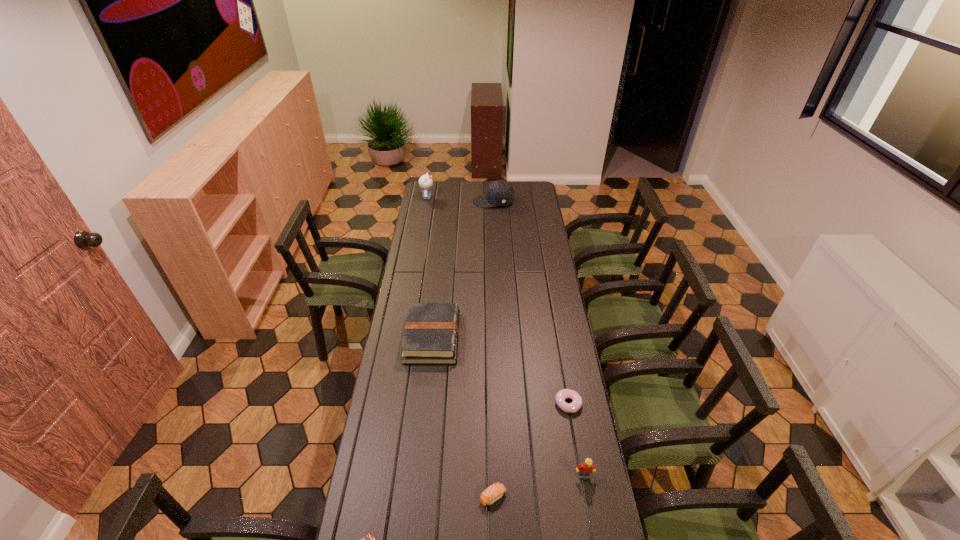
The image size is (960, 540). What are the coordinates of `kitten` in the screenshot? It's located at (425, 182).

Where is `baseball cap`? baseball cap is located at coordinates (500, 193).

Find the location of `the fifth shortest object`. the fifth shortest object is located at coordinates click(x=585, y=469).

Locate an element on the screen. The image size is (960, 540). the fifth farthest object is located at coordinates click(x=585, y=469).

Locate an element on the screen. The width and height of the screenshot is (960, 540). the fourth tallest object is located at coordinates (431, 334).

You are a GUI agent. You are given a task and a screenshot of the screen. Output one action in this format:
    pyautogui.click(x=<x>, y=<y>)
    Task: Click on the third farthest object
    
    Given the screenshot: What is the action you would take?
    pyautogui.click(x=431, y=334)

Find the location of a particular element. doughnut is located at coordinates 575,405.

Find the location of a particular element. This screenshot has width=960, height=540. the second nearest object is located at coordinates (494, 492).

At what (x,y) coordinates should I click in order to perform the action: click on free point located 0.400m on the front-facing side of the kitten. Please return your answer as a coordinate pair (x, y). The height and width of the screenshot is (540, 960). Looking at the image, I should click on pyautogui.click(x=499, y=198).

At what (x,y) coordinates should I click in order to perform the action: click on free spot located 0.330m at the front of the baseball cap where the brim is located. Please return your answer as a coordinate pair (x, y). Image resolution: width=960 pixels, height=540 pixels. Looking at the image, I should click on (420, 202).